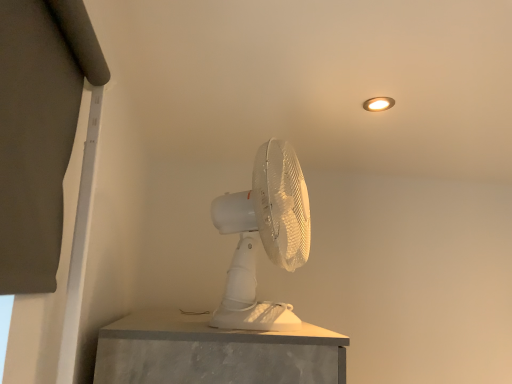
Locate an element on the screen. empty space that is to the right of matte white light fixture at upper right is located at coordinates (431, 104).